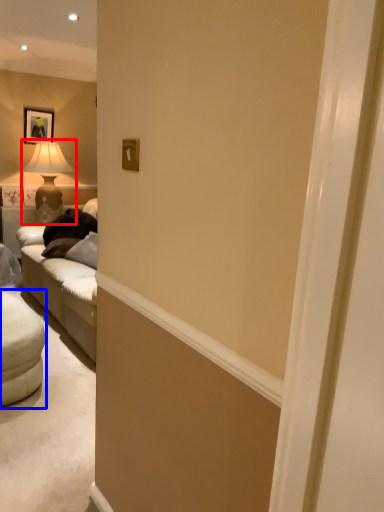
Question: Which object appears farthest to the camera in this image, table lamp (highlighted by a red box) or studio couch (highlighted by a blue box)?

Choices:
 (A) table lamp
 (B) studio couch

Answer: (A)